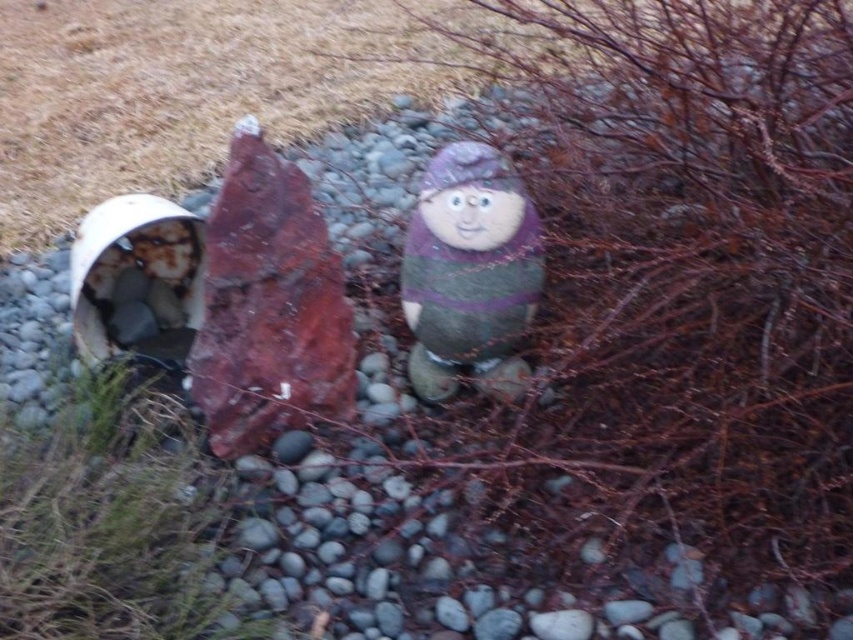
Question: Which point is closer to the camera?

Choices:
 (A) (440, 225)
 (B) (33, 538)

Answer: (B)

Question: Can you confirm if green grass at lower left is wider than matte painted stone figure at center?

Choices:
 (A) no
 (B) yes

Answer: (B)

Question: Is green grass at lower left to the right of matte painted stone figure at center from the viewer's perspective?

Choices:
 (A) yes
 (B) no

Answer: (B)

Question: Is green grass at lower left bigger than matte painted stone figure at center?

Choices:
 (A) no
 (B) yes

Answer: (B)

Question: Among these objects, which one is farthest from the camera?

Choices:
 (A) matte painted stone figure at center
 (B) green grass at lower left

Answer: (A)

Question: Which of the following is the farthest from the observer?

Choices:
 (A) (199, 525)
 (B) (439, 163)

Answer: (B)